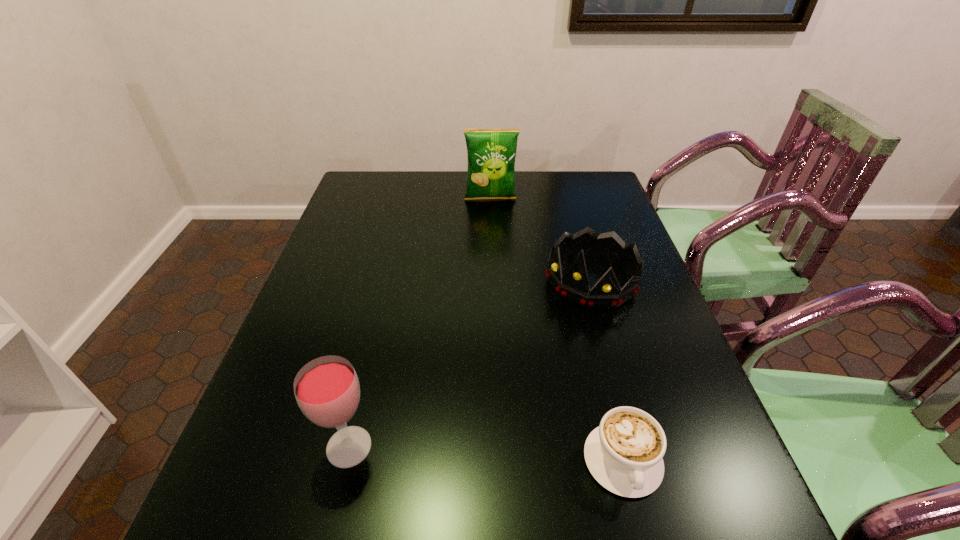
At what (x,y) coordinates should I click in order to perform the action: click on free spot located on the front-facing side of the farthest object. Please return your answer as a coordinate pair (x, y). The height and width of the screenshot is (540, 960). Looking at the image, I should click on (497, 266).

I want to click on free space located 0.260m at the front of the third nearest object with jewels, so click(x=517, y=376).

I want to click on vacant space positioned at the front of the third nearest object with jewels, so click(502, 395).

At what (x,y) coordinates should I click in order to perform the action: click on vacant region located 0.380m at the front of the third nearest object with jewels. Please return your answer as a coordinate pair (x, y). The image size is (960, 540). Looking at the image, I should click on (487, 416).

This screenshot has height=540, width=960. Identify the location of object that is at the far edge. (491, 153).

Find the location of a particular element. This screenshot has width=960, height=540. wineglass at the near edge is located at coordinates (327, 390).

Image resolution: width=960 pixels, height=540 pixels. Identify the location of cappuccino that is at the near edge. (624, 454).

Locate an element on the screen. This screenshot has width=960, height=540. cappuccino at the right edge is located at coordinates (624, 454).

Identify the location of tiara located at the right edge. The width and height of the screenshot is (960, 540). (575, 287).

Where is `object positioned at the near right corner`? object positioned at the near right corner is located at coordinates (624, 454).